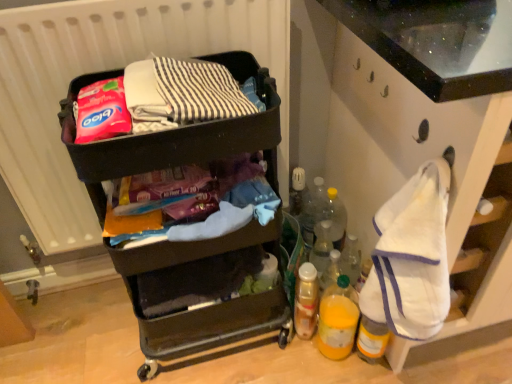
This screenshot has height=384, width=512. What do you see at coordinates (331, 270) in the screenshot? I see `translucent plastic bottle at lower right, the third bottle from the bottom` at bounding box center [331, 270].

Image resolution: width=512 pixels, height=384 pixels. What do you see at coordinates (199, 294) in the screenshot? I see `black plastic cart at upper left` at bounding box center [199, 294].

Describe the element at coordinates (192, 202) in the screenshot. I see `matte plastic cart at center, the first waste ordered from the bottom` at that location.

What is the approximate width of white matte radiator at upper left?

6.20 inches.

How much space does matte black suitcase at upper center, acting as the first waste starting from the top, occupy horizontally?

It is 10.80 inches.

Identify the location of translucent yellow bottle at lower right, the fourth bottle positioned from the top. (337, 320).

Describe the element at coordinates (337, 320) in the screenshot. This screenshot has width=512, height=384. I see `translucent yellow bottle at lower right, the fourth bottle positioned from the top` at that location.

In order to click on translucent plastic bottle at lower right, the 2th bottle in the top-to-bottom sequence in this screenshot , I will do `click(331, 270)`.

Is point (353, 326) farther from camera compared to point (417, 99)?

Yes, it is behind point (417, 99).

Between translucent yellow bottle at lower right, the fourth bottle positioned from the top, and white fabric at right, which one has smaller width?

translucent yellow bottle at lower right, the fourth bottle positioned from the top, is thinner.

Consider the image. From a real-world perspective, between translucent yellow bottle at lower right, the fourth bottle positioned from the top, and white fabric at right, who is vertically lower?

translucent yellow bottle at lower right, the fourth bottle positioned from the top, from a real-world perspective.

Is translucent yellow bottle at lower right, the fourth bottle positioned from the top, not within white fabric at right?

Yes, translucent yellow bottle at lower right, the fourth bottle positioned from the top, is located beyond the bounds of white fabric at right.

Considering the relative positions of translucent yellow bottle at lower right, the 1th bottle when ordered from bottom to top, and translucent plastic bottle at lower right, which is counted as the fourth bottle, starting from the bottom, in the image provided, is translucent yellow bottle at lower right, the 1th bottle when ordered from bottom to top, to the left or to the right of translucent plastic bottle at lower right, which is counted as the fourth bottle, starting from the bottom,?

Clearly, translucent yellow bottle at lower right, the 1th bottle when ordered from bottom to top, is on the right of translucent plastic bottle at lower right, which is counted as the fourth bottle, starting from the bottom, in the image.

In the scene shown: Is translucent yellow bottle at lower right, the 1th bottle when ordered from bottom to top, in contact with translucent plastic bottle at lower right, which is counted as the fourth bottle, starting from the bottom?

No, translucent yellow bottle at lower right, the 1th bottle when ordered from bottom to top, is not making contact with translucent plastic bottle at lower right, which is counted as the fourth bottle, starting from the bottom.

From the picture: Is translucent plastic bottle at lower right, the 1th bottle from the top, completely or partially inside translucent yellow bottle at lower right, the 1th bottle when ordered from bottom to top?

No, translucent plastic bottle at lower right, the 1th bottle from the top, is located outside of translucent yellow bottle at lower right, the 1th bottle when ordered from bottom to top.

Between translucent yellow bottle at lower right, the 1th bottle when ordered from bottom to top, and translucent plastic bottle at lower right, the 1th bottle from the top, which one is positioned in front?

translucent yellow bottle at lower right, the 1th bottle when ordered from bottom to top, is in front.

Would you say white fabric at right contains translucent yellow bottle at lower right, the 1th bottle when ordered from bottom to top?

No, translucent yellow bottle at lower right, the 1th bottle when ordered from bottom to top, is located outside of white fabric at right.

Which of these two, white fabric at right or translucent yellow bottle at lower right, the fourth bottle positioned from the top, is smaller?

With smaller size is translucent yellow bottle at lower right, the fourth bottle positioned from the top.

The image size is (512, 384). I want to click on bottle that is the 1st one when counting leftward from the white fabric at right, so click(x=337, y=320).

Between translucent plastic bottle at lower right, the 2th bottle in the top-to-bottom sequence, and translucent plastic spray can at lower center, which is counted as the 3th bottle, starting from the top, which one has more height?

With more height is translucent plastic spray can at lower center, which is counted as the 3th bottle, starting from the top.

Is translucent plastic spray can at lower center, placed as the 2th bottle when sorted from bottom to top, completely or partially inside translucent plastic bottle at lower right, the 2th bottle in the top-to-bottom sequence?

Actually, translucent plastic spray can at lower center, placed as the 2th bottle when sorted from bottom to top, is outside translucent plastic bottle at lower right, the 2th bottle in the top-to-bottom sequence.

How many degrees apart are the facing directions of translucent plastic bottle at lower right, the 2th bottle in the top-to-bottom sequence, and translucent plastic spray can at lower center, placed as the 2th bottle when sorted from bottom to top?

translucent plastic bottle at lower right, the 2th bottle in the top-to-bottom sequence, and translucent plastic spray can at lower center, placed as the 2th bottle when sorted from bottom to top, are facing 0.955 degrees away from each other.

Which point is more distant from viewer, [328,273] or [305,275]?

The point [328,273] is behind.

Is black plastic cart at upper left positioned with its back to translucent yellow bottle at lower right, the fourth bottle positioned from the top?

No, black plastic cart at upper left is not facing away from translucent yellow bottle at lower right, the fourth bottle positioned from the top.

Can you confirm if black plastic cart at upper left is thinner than translucent yellow bottle at lower right, the fourth bottle positioned from the top?

No.

Is black plastic cart at upper left positioned far away from translucent yellow bottle at lower right, the 1th bottle when ordered from bottom to top?

No, black plastic cart at upper left is in close proximity to translucent yellow bottle at lower right, the 1th bottle when ordered from bottom to top.

Between point (278, 232) and point (332, 316), which one is positioned in front?

The point (278, 232) is closer.

In the scene shown: Considering the relative sizes of translucent plastic spray can at lower center, which is counted as the 3th bottle, starting from the top, and translucent plastic bottle at lower right, which is counted as the fourth bottle, starting from the bottom, in the image provided, is translucent plastic spray can at lower center, which is counted as the 3th bottle, starting from the top, taller than translucent plastic bottle at lower right, which is counted as the fourth bottle, starting from the bottom,?

Correct, translucent plastic spray can at lower center, which is counted as the 3th bottle, starting from the top, is much taller as translucent plastic bottle at lower right, which is counted as the fourth bottle, starting from the bottom.

Between translucent plastic spray can at lower center, placed as the 2th bottle when sorted from bottom to top, and translucent plastic bottle at lower right, the 1th bottle from the top, which one appears on the left side from the viewer's perspective?

translucent plastic spray can at lower center, placed as the 2th bottle when sorted from bottom to top, is more to the left.

This screenshot has width=512, height=384. Identify the location of the 2nd bottle below the translucent plastic bottle at lower right, which is counted as the fourth bottle, starting from the bottom (from the image's perspective). (306, 301).

Is translucent plastic bottle at lower right, the third bottle from the bottom, not near translucent yellow bottle at lower right, the fourth bottle positioned from the top?

No, there isn't a large distance between translucent plastic bottle at lower right, the third bottle from the bottom, and translucent yellow bottle at lower right, the fourth bottle positioned from the top.

Between translucent plastic bottle at lower right, the third bottle from the bottom, and translucent yellow bottle at lower right, the 1th bottle when ordered from bottom to top, which one has smaller size?

translucent plastic bottle at lower right, the third bottle from the bottom, is smaller.

Considering the positions of objects translucent plastic bottle at lower right, the 2th bottle in the top-to-bottom sequence, and translucent yellow bottle at lower right, the fourth bottle positioned from the top, in the image provided, who is behind, translucent plastic bottle at lower right, the 2th bottle in the top-to-bottom sequence, or translucent yellow bottle at lower right, the fourth bottle positioned from the top,?

translucent plastic bottle at lower right, the 2th bottle in the top-to-bottom sequence, is more distant.

Where is `the 1st bottle behind the white fabric at right, starting your count from the anchor`? The image size is (512, 384). the 1st bottle behind the white fabric at right, starting your count from the anchor is located at coordinates (337, 320).

Starting from the translucent plastic bottle at lower right, the 1th bottle from the top, which bottle is the 2nd one to the right? Please provide its 2D coordinates.

[(337, 320)]

Looking at the image, which one is located closer to translucent yellow bottle at lower right, the fourth bottle positioned from the top, translucent plastic spray can at lower center, placed as the 2th bottle when sorted from bottom to top, or translucent plastic bottle at lower right, the 2th bottle in the top-to-bottom sequence?

Among the two, translucent plastic spray can at lower center, placed as the 2th bottle when sorted from bottom to top, is located nearer to translucent yellow bottle at lower right, the fourth bottle positioned from the top.

Looking at the image, which one is located further to translucent plastic spray can at lower center, which is counted as the 3th bottle, starting from the top, matte plastic cart at center, the first waste ordered from the bottom, or black plastic cart at upper left?

matte plastic cart at center, the first waste ordered from the bottom, is positioned further to the anchor translucent plastic spray can at lower center, which is counted as the 3th bottle, starting from the top.

When comparing their distances from white matte radiator at upper left, does black plastic cart at upper left or translucent plastic bottle at lower right, which is counted as the fourth bottle, starting from the bottom, seem closer?

The object closer to white matte radiator at upper left is black plastic cart at upper left.

Looking at the image, which one is located closer to translucent plastic bottle at lower right, the third bottle from the bottom, translucent plastic spray can at lower center, which is counted as the 3th bottle, starting from the top, or white matte radiator at upper left?

translucent plastic spray can at lower center, which is counted as the 3th bottle, starting from the top, lies closer to translucent plastic bottle at lower right, the third bottle from the bottom, than the other object.

Based on their spatial positions, is black plastic cart at upper left or translucent plastic bottle at lower right, the 2th bottle in the top-to-bottom sequence, further from white fabric at right?

Based on the image, black plastic cart at upper left appears to be further to white fabric at right.

Looking at the image, which one is located further to translucent yellow bottle at lower right, the 1th bottle when ordered from bottom to top, translucent plastic bottle at lower right, the 1th bottle from the top, or translucent plastic bottle at lower right, the third bottle from the bottom?

translucent plastic bottle at lower right, the 1th bottle from the top, is positioned further to the anchor translucent yellow bottle at lower right, the 1th bottle when ordered from bottom to top.

Looking at the image, which one is located closer to black plastic cart at upper left, white fabric at right or translucent yellow bottle at lower right, the 1th bottle when ordered from bottom to top?

Based on the image, translucent yellow bottle at lower right, the 1th bottle when ordered from bottom to top, appears to be nearer to black plastic cart at upper left.

In the scene shown: When comparing their distances from white fabric at right, does white matte radiator at upper left or translucent plastic spray can at lower center, placed as the 2th bottle when sorted from bottom to top, seem closer?

Based on the image, translucent plastic spray can at lower center, placed as the 2th bottle when sorted from bottom to top, appears to be nearer to white fabric at right.

Find the location of a particular element. The height and width of the screenshot is (384, 512). furniture positioned between white fabric at right and translucent plastic bottle at lower right, the third bottle from the bottom, from near to far is located at coordinates (199, 294).

In order to click on furniture between white matte radiator at upper left and translucent plastic spray can at lower center, placed as the 2th bottle when sorted from bottom to top, in the up-down direction in this screenshot , I will do `click(199, 294)`.

Identify the location of waste between white matte radiator at upper left and black plastic cart at upper left vertically. (192, 202).

Find the location of a particular element. furniture between white fabric at right and translucent plastic bottle at lower right, which is counted as the fourth bottle, starting from the bottom, from front to back is located at coordinates (199, 294).